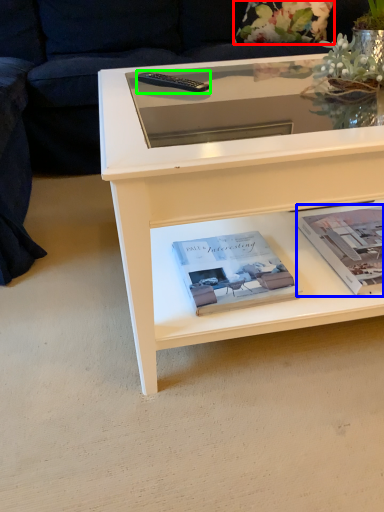
Question: Estimate the real-world distances between objects in this image. Which object is farther from flower (highlighted by a red box), paperback book (highlighted by a blue box) or remote (highlighted by a green box)?

Choices:
 (A) paperback book
 (B) remote

Answer: (A)